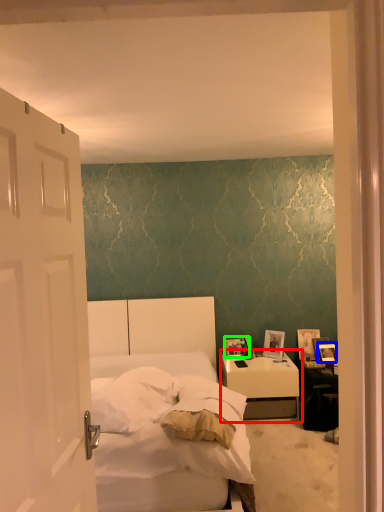
Question: Based on their relative distances, which object is nearer to nightstand (highlighted by a red box)? Choose from picture frame (highlighted by a blue box) and picture frame (highlighted by a green box).

Choices:
 (A) picture frame
 (B) picture frame

Answer: (B)